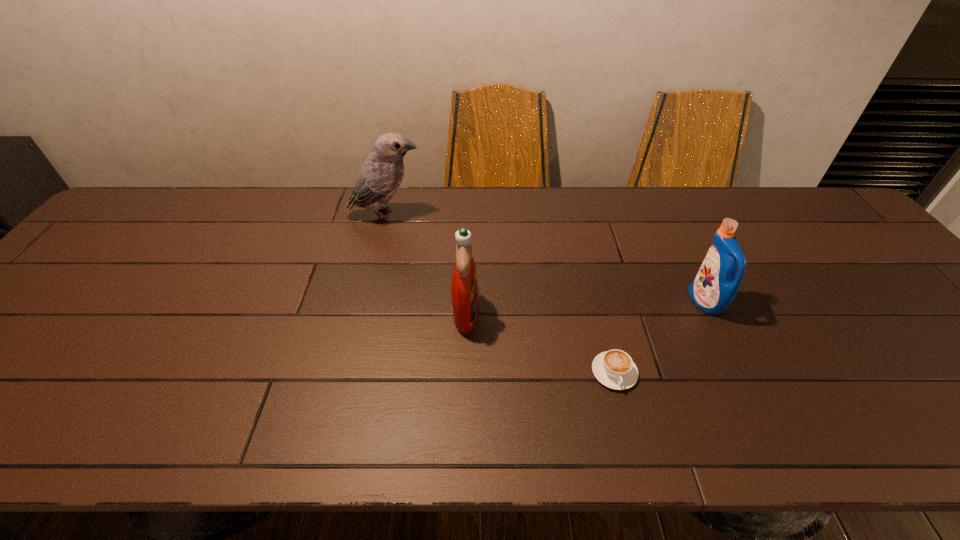
Where is `the leftmost object`? the leftmost object is located at coordinates (379, 178).

Where is `parrot`? This screenshot has height=540, width=960. parrot is located at coordinates (379, 178).

Where is `the second object from left to right`? The height and width of the screenshot is (540, 960). the second object from left to right is located at coordinates (464, 286).

This screenshot has height=540, width=960. In order to click on the rightmost object in this screenshot , I will do `click(715, 286)`.

The height and width of the screenshot is (540, 960). In order to click on the shortest object in this screenshot , I will do `click(615, 369)`.

Identify the location of the nearest object. The height and width of the screenshot is (540, 960). (615, 369).

The width and height of the screenshot is (960, 540). Find the location of `free region located on the front-facing side of the farthest object`. free region located on the front-facing side of the farthest object is located at coordinates (513, 217).

The width and height of the screenshot is (960, 540). What are the coordinates of `free space located on the front surface of the left detergent` in the screenshot? It's located at pyautogui.click(x=638, y=312).

The image size is (960, 540). Find the location of `vacant region located on the label of the rightmost object`. vacant region located on the label of the rightmost object is located at coordinates (532, 302).

The height and width of the screenshot is (540, 960). What are the coordinates of `vacant region located 0.290m on the label of the rightmost object` in the screenshot? It's located at (576, 302).